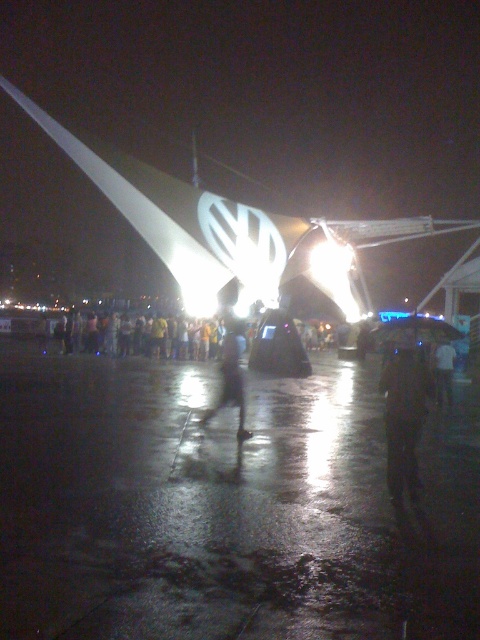
You are at the event and want to take a photo of both the yellow casual clothing at center and the dark matte figure at center. Which one should you focus on first if you want to capture both in the same frame without adjusting your camera settings?

The yellow casual clothing at center is shorter than the dark matte figure at center, so focusing on the dark matte figure at center first would ensure both are in focus since it is taller and likely closer to the background.

You are at the event and see the black matte jacket at center and the transparent plastic umbrella at center. Which object is closer to the left side of the image?

The black matte jacket at center is closer to the left side of the image because it is positioned to the left of the transparent plastic umbrella at center.

You are at the event and want to take a photo of both the yellow casual clothing at center and the dark matte figure at center without any obstruction. Based on their positions, which one should you focus on first to ensure both are in frame?

The yellow casual clothing at center is to the left of dark matte figure at center, so you should focus on the dark matte figure at center first to ensure both are in frame by adjusting the camera angle to include both the left and right positioned subjects.